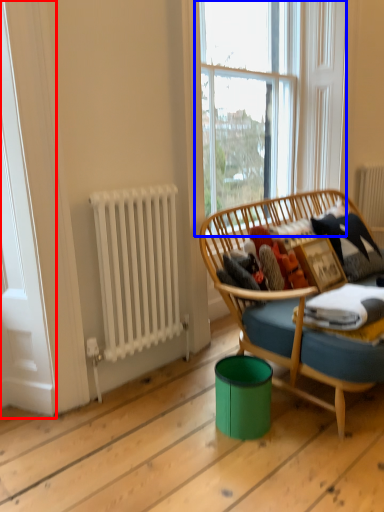
Question: Which of the following is the closest to the observer, screen door (highlighted by a red box) or window (highlighted by a blue box)?

Choices:
 (A) screen door
 (B) window

Answer: (A)